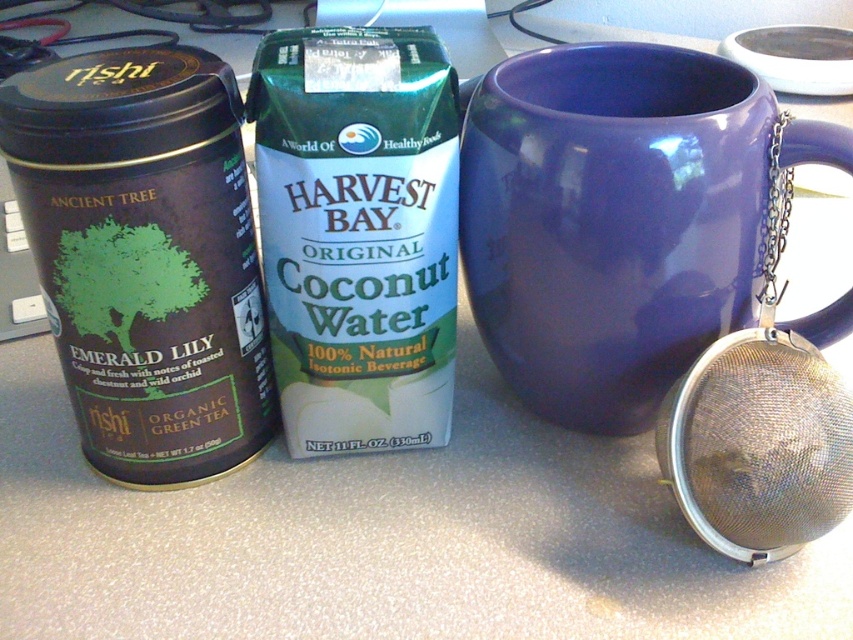
You are setting up a tea station and need to choose between placing a decorative item or a functional item. The glossy ceramic mug at upper center and the matte black organic green tea can at left are both on the countertop. Which item is better suited for holding hot tea?

The glossy ceramic mug at upper center is better suited for holding hot tea because it has a larger size compared to the matte black organic green tea can at left, making it more functional for serving beverages.

What is the spatial relationship between the glossy ceramic mug at upper center and the silver mesh strainer at right?

The glossy ceramic mug at upper center is to the left of the silver mesh strainer at right.